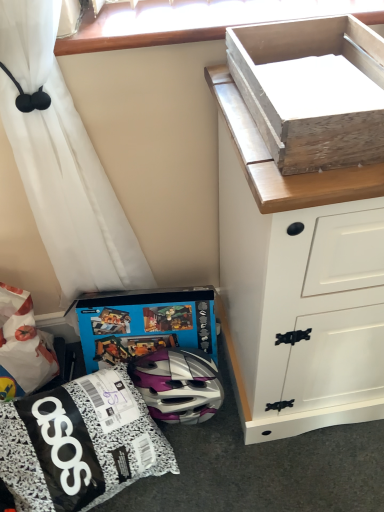
Question: Could you tell me if wooden box at upper right is turned towards blue cardboard box at lower center?

Choices:
 (A) no
 (B) yes

Answer: (A)

Question: Can you confirm if wooden box at upper right is positioned to the left of blue cardboard box at lower center?

Choices:
 (A) no
 (B) yes

Answer: (A)

Question: Is wooden box at upper right closer to the viewer compared to blue cardboard box at lower center?

Choices:
 (A) yes
 (B) no

Answer: (A)

Question: Does wooden box at upper right have a lesser height compared to blue cardboard box at lower center?

Choices:
 (A) yes
 (B) no

Answer: (A)

Question: Are wooden box at upper right and blue cardboard box at lower center far apart?

Choices:
 (A) yes
 (B) no

Answer: (B)

Question: Does wooden box at upper right have a greater height compared to blue cardboard box at lower center?

Choices:
 (A) no
 (B) yes

Answer: (A)

Question: Is blue cardboard box at lower center positioned before wooden box at upper right?

Choices:
 (A) yes
 (B) no

Answer: (B)

Question: Does blue cardboard box at lower center have a lesser width compared to wooden box at upper right?

Choices:
 (A) no
 (B) yes

Answer: (B)

Question: From the image's perspective, is blue cardboard box at lower center beneath wooden box at upper right?

Choices:
 (A) yes
 (B) no

Answer: (A)

Question: Does blue cardboard box at lower center turn towards wooden box at upper right?

Choices:
 (A) no
 (B) yes

Answer: (A)

Question: Is blue cardboard box at lower center turned away from wooden box at upper right?

Choices:
 (A) no
 (B) yes

Answer: (A)

Question: From a real-world perspective, is blue cardboard box at lower center positioned over wooden box at upper right based on gravity?

Choices:
 (A) yes
 (B) no

Answer: (B)

Question: Does matte black helmet at lower center appear on the left side of blue cardboard box at lower center?

Choices:
 (A) no
 (B) yes

Answer: (B)